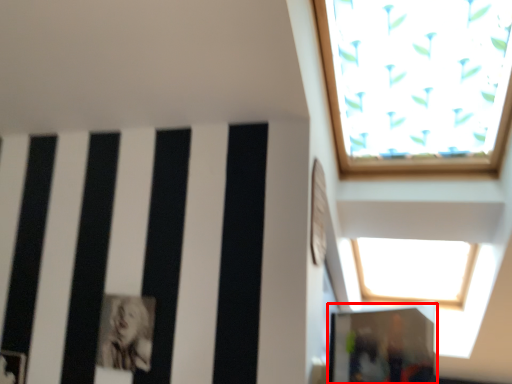
Question: From the image's perspective, considering the relative positions of glass door (annotated by the red box) and person in the image provided, where is glass door (annotated by the red box) located with respect to the staircase?

Choices:
 (A) above
 (B) below

Answer: (B)